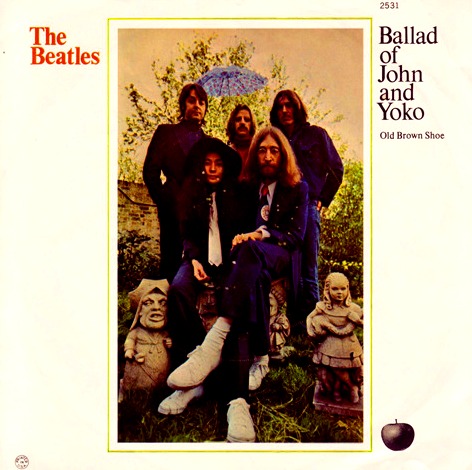
You are a GUI agent. You are given a task and a screenshot of the screen. Output one action in this format:
    pyautogui.click(x=<x>, y=<y>)
    Task: Click on the brick wall
    The height and width of the screenshot is (470, 472).
    Given the screenshot: What is the action you would take?
    pyautogui.click(x=141, y=218)